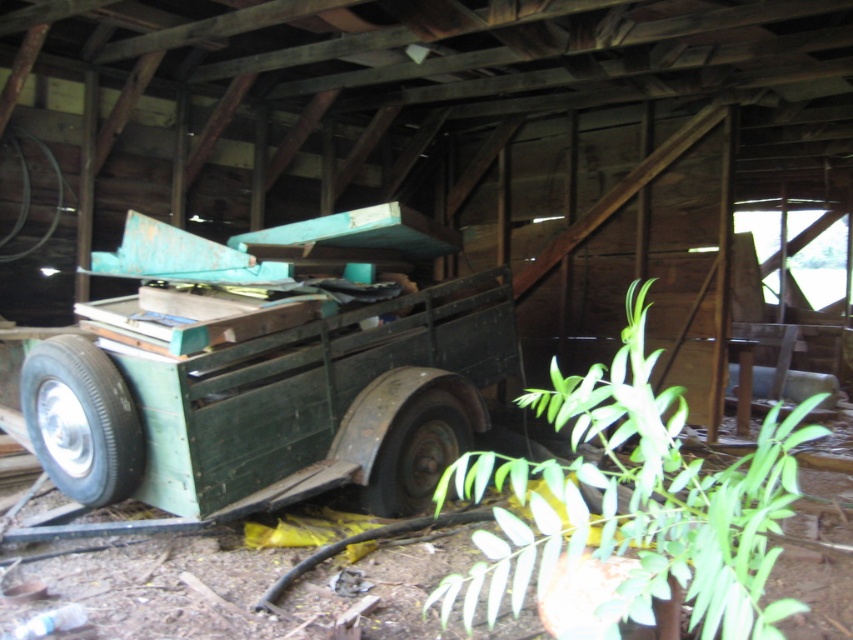
Does green matte trailer at center have a lesser width compared to green leafy plant at lower right?

In fact, green matte trailer at center might be wider than green leafy plant at lower right.

Is point (231, 332) positioned in front of point (602, 406)?

No, (231, 332) is behind (602, 406).

You are a GUI agent. You are given a task and a screenshot of the screen. Output one action in this format:
    pyautogui.click(x=<x>, y=<y>)
    Task: Click on the green matte trailer at center
    The width and height of the screenshot is (853, 640).
    Given the screenshot: What is the action you would take?
    pyautogui.click(x=268, y=371)

Describe the element at coordinates (268, 371) in the screenshot. The image size is (853, 640). I see `green matte trailer at center` at that location.

Does green matte trailer at center appear over black rubber tire at lower left?

Correct, green matte trailer at center is located above black rubber tire at lower left.

At what (x,y) coordinates should I click in order to perform the action: click on green matte trailer at center. Please return your answer as a coordinate pair (x, y). Image resolution: width=853 pixels, height=640 pixels. Looking at the image, I should click on (268, 371).

Find the location of a particular element. The height and width of the screenshot is (640, 853). green matte trailer at center is located at coordinates [268, 371].

Can you confirm if green matte trailer at center is smaller than dark green rubber tire at center?

Actually, green matte trailer at center might be larger than dark green rubber tire at center.

Between green matte trailer at center and dark green rubber tire at center, which one is positioned higher?

green matte trailer at center is above.

Identify the location of green matte trailer at center. (268, 371).